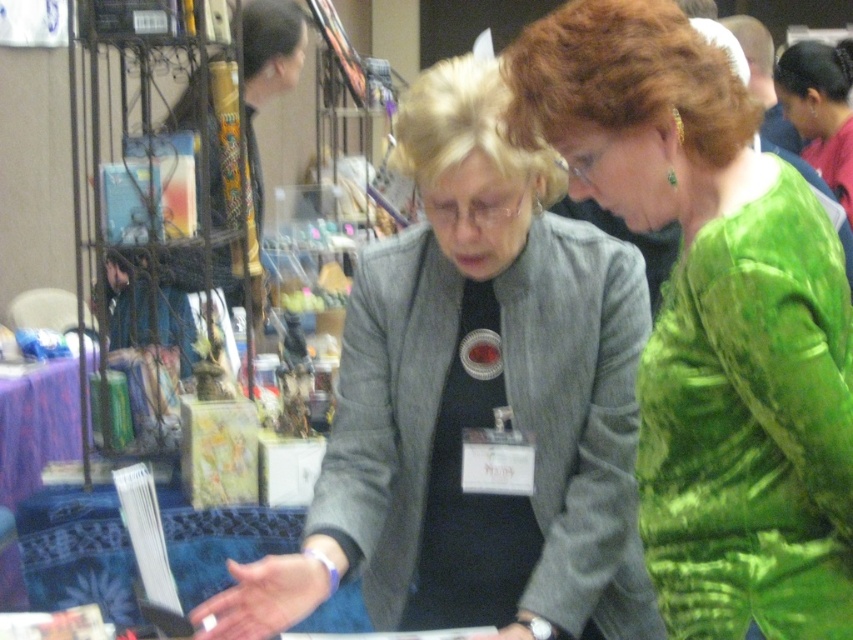
Who is more forward, (491, 224) or (790, 99)?

Point (491, 224) is more forward.

Does matte gray blazer at center have a greater width compared to green shiny dress at upper right?

No.

Is point (341, 369) behind point (798, 129)?

No, (341, 369) is closer to viewer.

Find the location of a particular element. matte gray blazer at center is located at coordinates (474, 404).

Between point (447, 125) and point (767, 564), which one is positioned in front?

Point (767, 564) is more forward.

This screenshot has width=853, height=640. In order to click on matte gray blazer at center in this screenshot , I will do `click(474, 404)`.

At what (x,y) coordinates should I click in order to perform the action: click on matte gray blazer at center. Please return your answer as a coordinate pair (x, y). The image size is (853, 640). Looking at the image, I should click on coord(474,404).

Can you confirm if green shiny dress at center is positioned to the right of green textured dress at center?

In fact, green shiny dress at center is to the left of green textured dress at center.

Is green shiny dress at center thinner than green textured dress at center?

In fact, green shiny dress at center might be wider than green textured dress at center.

Is point (639, 465) positioned after point (793, 272)?

Yes, point (639, 465) is farther from viewer.

I want to click on green shiny dress at center, so click(712, 320).